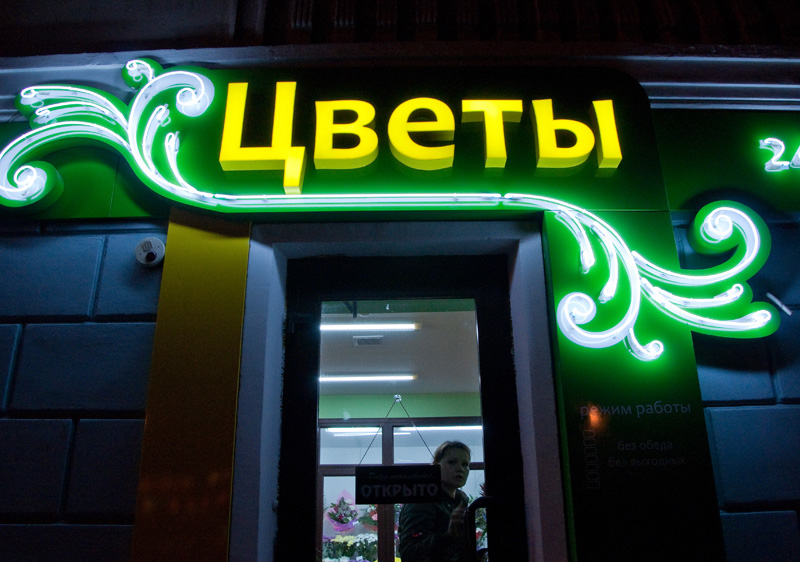
Locate an element on the screen. door is located at coordinates (374, 289).